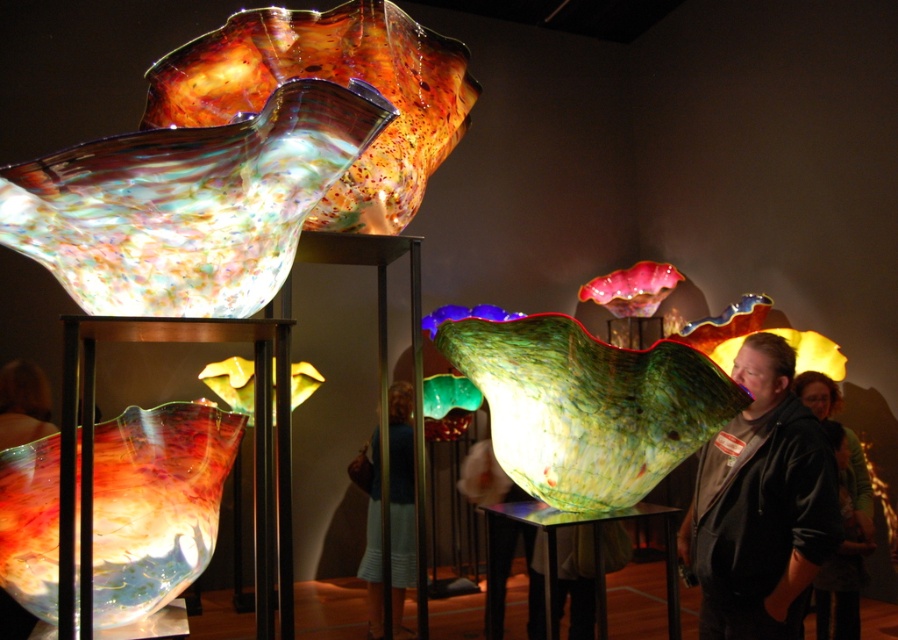
Who is positioned more to the left, multicolored glass sculpture at upper left or dark brown leather jacket at lower right?

Positioned to the left is multicolored glass sculpture at upper left.

Is multicolored glass sculpture at upper left to the left of dark brown leather jacket at lower right from the viewer's perspective?

Indeed, multicolored glass sculpture at upper left is positioned on the left side of dark brown leather jacket at lower right.

Does point (203, 257) lie behind point (858, 504)?

No, it is in front of (858, 504).

Find the location of `multicolored glass sculpture at upper left`. multicolored glass sculpture at upper left is located at coordinates (188, 204).

Can you confirm if matte black jacket at right is positioned to the right of dark brown leather jacket at lower right?

Incorrect, matte black jacket at right is not on the right side of dark brown leather jacket at lower right.

You are a GUI agent. You are given a task and a screenshot of the screen. Output one action in this format:
    pyautogui.click(x=<x>, y=<y>)
    Task: Click on the matte black jacket at right
    
    Given the screenshot: What is the action you would take?
    pyautogui.click(x=762, y=504)

Identify the location of matte black jacket at right. The width and height of the screenshot is (898, 640). (762, 504).

Is matte black jacket at right behind blue fabric dress at center?

That is False.

Is point (724, 630) in front of point (399, 392)?

Yes.

I want to click on matte black jacket at right, so click(x=762, y=504).